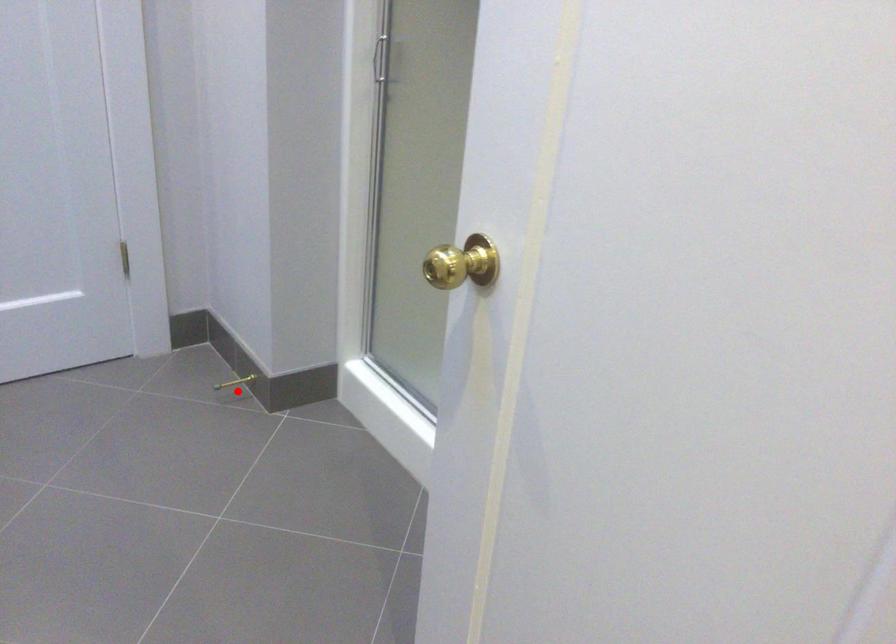
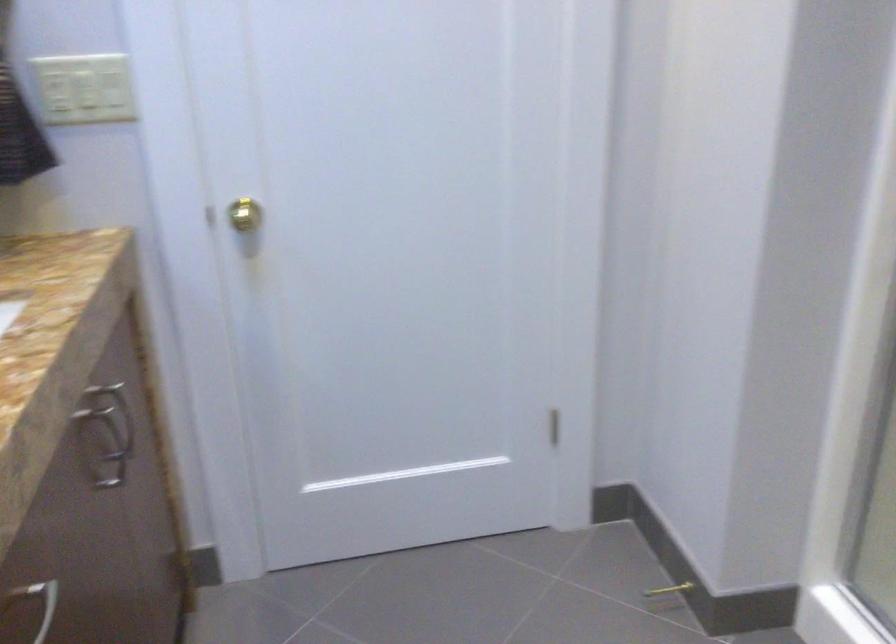
Question: I am providing you with two images of the same scene from different viewpoints. Given a red point in image1, look at the same physical point in image2. Is it:

Choices:
 (A) Closer to the viewpoint
 (B) Farther from the viewpoint

Answer: (A)